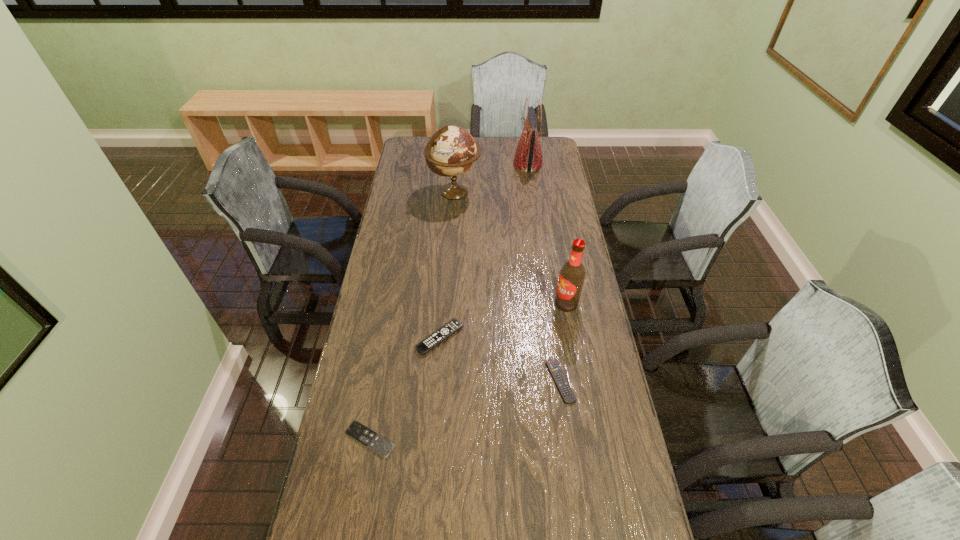
The height and width of the screenshot is (540, 960). I want to click on remote control that is at the right edge, so click(554, 368).

The width and height of the screenshot is (960, 540). In order to click on object that is positioned at the far right corner in this screenshot , I will do `click(528, 157)`.

At what (x,y) coordinates should I click in order to perform the action: click on vacant space at the left edge of the desktop. Please return your answer as a coordinate pair (x, y). This screenshot has width=960, height=540. Looking at the image, I should click on (343, 490).

This screenshot has width=960, height=540. Identify the location of vacant region at the right edge of the desktop. (594, 526).

Identify the location of free region at the far right corner of the desktop. (545, 150).

This screenshot has height=540, width=960. What are the coordinates of `empty space between the globe and the farthest object` in the screenshot? It's located at (492, 178).

Identify the location of free space that is in between the farthest object and the fifth nearest object. The image size is (960, 540). (492, 178).

This screenshot has height=540, width=960. I want to click on free area in between the leftmost remote control and the globe, so click(x=412, y=316).

The image size is (960, 540). I want to click on free space between the second nearest remote control and the beer bottle, so click(564, 342).

At what (x,y) coordinates should I click in order to perform the action: click on free space between the farthest object and the second tallest remote control. Please return your answer as a coordinate pair (x, y). This screenshot has width=960, height=540. Looking at the image, I should click on (544, 273).